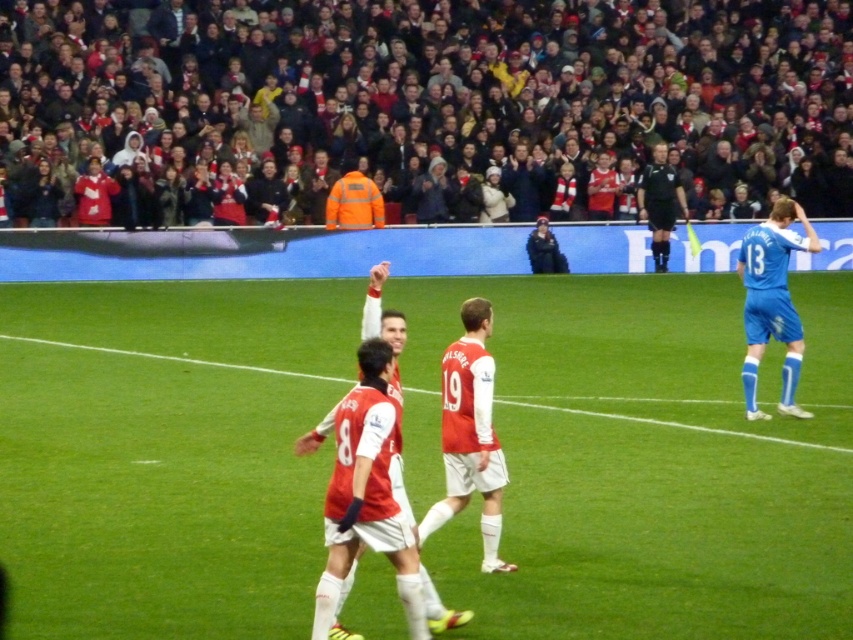
You are a soccer referee positioned at point (660, 202). You need to quickly assess the situation. What is the nearest object to your current position?

The nearest object to your current position at point (660, 202) is the black uniform at center.

You are a soccer coach analyzing the field positions. You notice the blue smooth jersey at right. Where exactly is it positioned on the field?

The blue smooth jersey at right is located at point (772, 301) on the field.